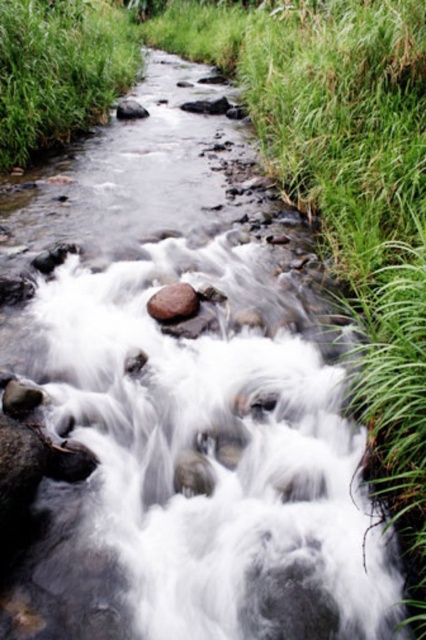
Question: Where is smooth brown rock at center located in relation to smooth gray rock at center in the image?

Choices:
 (A) right
 (B) left

Answer: (A)

Question: Among these objects, which one is nearest to the camera?

Choices:
 (A) smooth gray rock at center
 (B) smooth brown rock at center

Answer: (B)

Question: Can you confirm if smooth brown rock at center is positioned to the left of smooth gray rock at center?

Choices:
 (A) yes
 (B) no

Answer: (B)

Question: Which of the following is the closest to the observer?

Choices:
 (A) smooth brown rock at center
 (B) smooth gray rock at center

Answer: (A)

Question: Is smooth brown rock at center thinner than smooth gray rock at center?

Choices:
 (A) yes
 (B) no

Answer: (A)